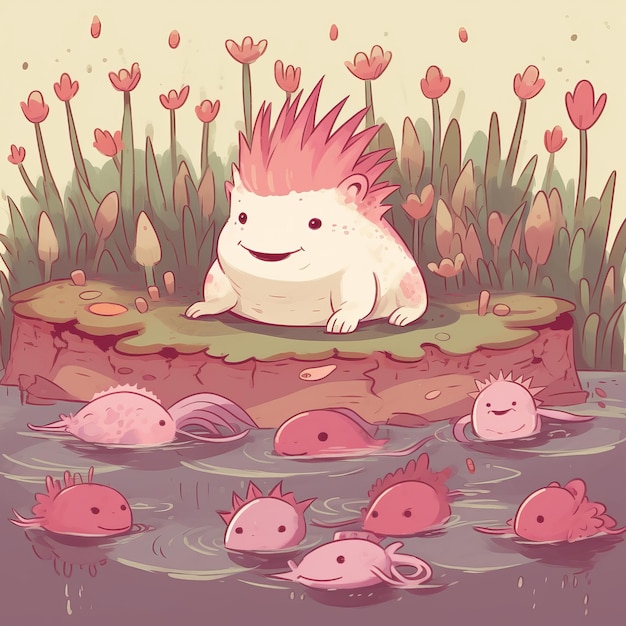
Locate an element on the screen. The image size is (626, 626). plant is located at coordinates (x=580, y=265).